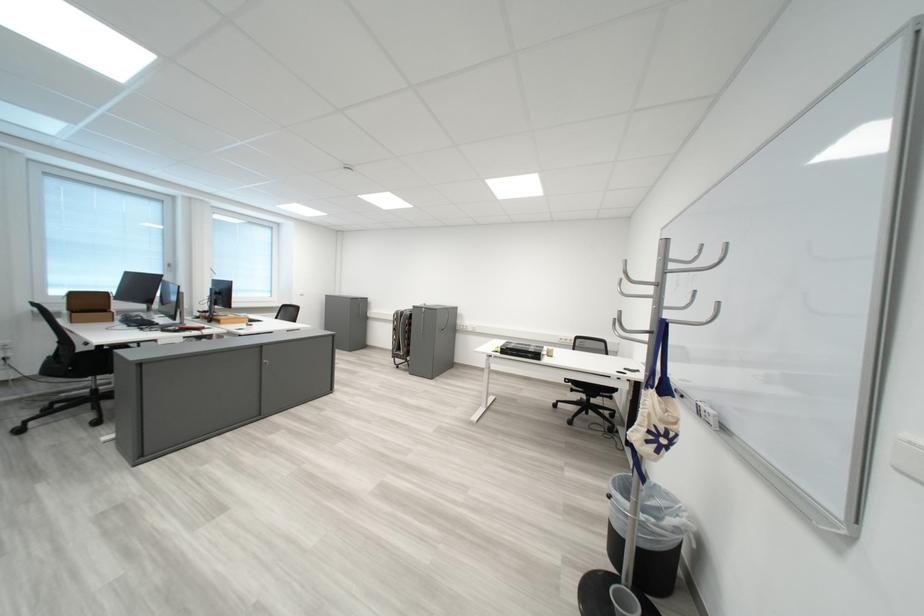
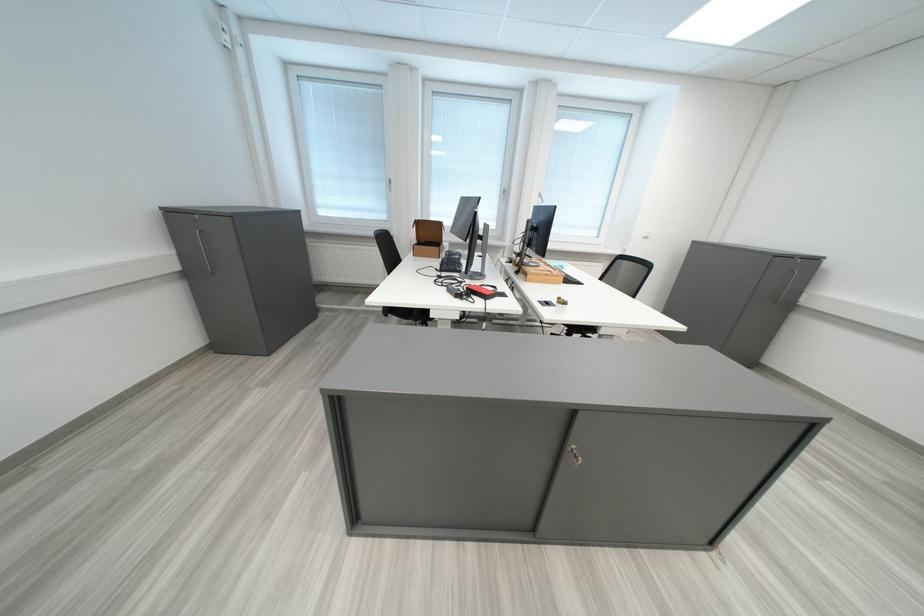
Locate, in the second image, the point that corresponds to [232,323] in the first image.

(539, 276)